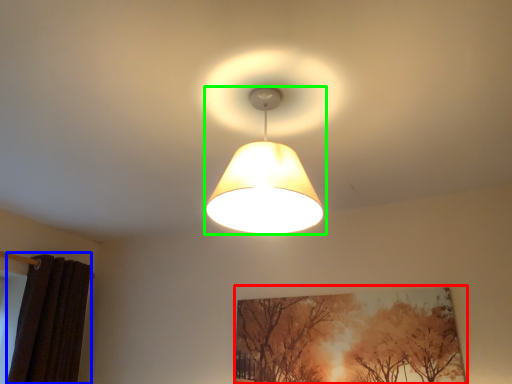
Question: Estimate the real-world distances between objects in this image. Which object is farther from picture frame (highlighted by a red box), curtain (highlighted by a blue box) or lamp (highlighted by a green box)?

Choices:
 (A) curtain
 (B) lamp

Answer: (A)